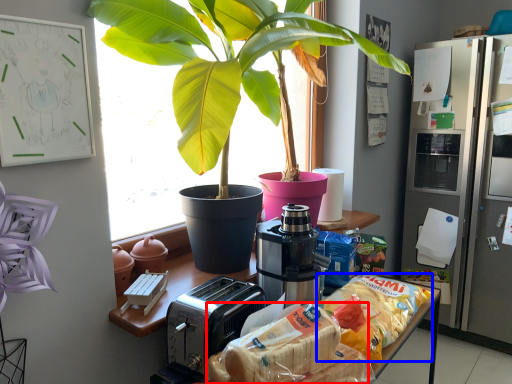
Question: Which point is closer to the camera, snack (highlighted by a red box) or snack (highlighted by a blue box)?

Choices:
 (A) snack
 (B) snack

Answer: (A)